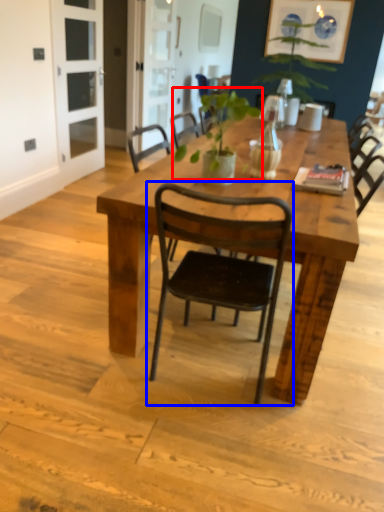
Question: Which object appears farthest to the camera in this image, plant (highlighted by a red box) or chair (highlighted by a blue box)?

Choices:
 (A) plant
 (B) chair

Answer: (A)